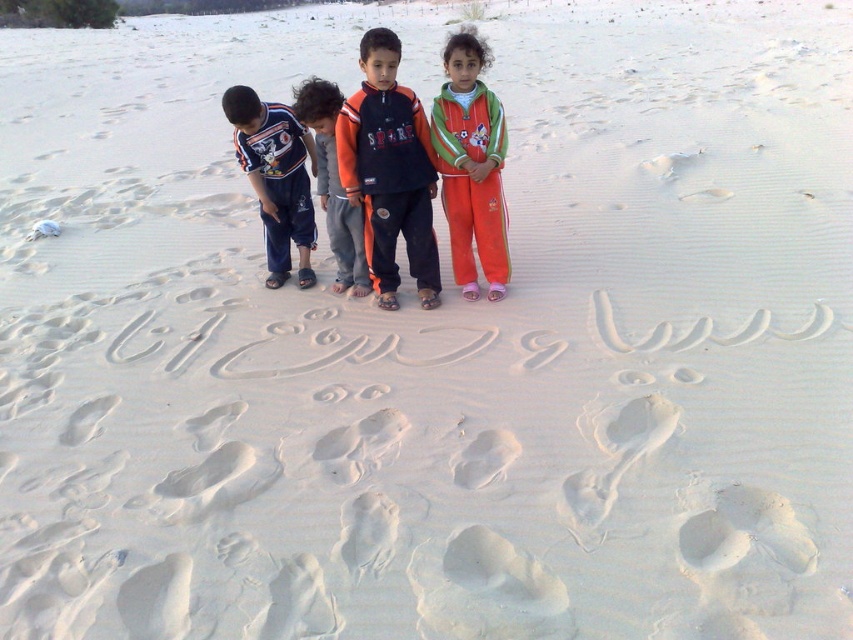
Question: Which point is farther to the camera?

Choices:
 (A) orange cotton pants at left
 (B) orange fleece tracksuit at center
 (C) orange cotton shirt at center
 (D) orange fleece jacket at center

Answer: (A)

Question: Is orange cotton shirt at center to the right of orange fleece jacket at center from the viewer's perspective?

Choices:
 (A) no
 (B) yes

Answer: (B)

Question: Does orange cotton shirt at center lie behind orange fleece tracksuit at center?

Choices:
 (A) no
 (B) yes

Answer: (A)

Question: Which of the following is the closest to the observer?

Choices:
 (A) (303, 202)
 (B) (316, 160)

Answer: (B)

Question: Which object is the farthest from the orange cotton pants at left?

Choices:
 (A) orange fleece jacket at center
 (B) orange fleece tracksuit at center
 (C) orange cotton shirt at center

Answer: (B)

Question: Is orange fleece tracksuit at center thinner than orange cotton pants at left?

Choices:
 (A) yes
 (B) no

Answer: (A)